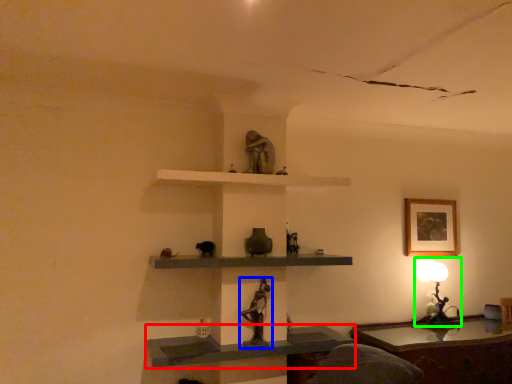
Question: Which object is the closest to the shelf (highlighted by a red box)? Choose among these: sculpture (highlighted by a blue box) or table lamp (highlighted by a green box).

Choices:
 (A) sculpture
 (B) table lamp

Answer: (A)